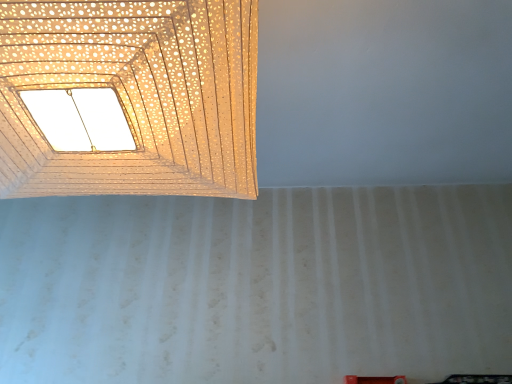
This screenshot has height=384, width=512. What do you see at coordinates (135, 95) in the screenshot?
I see `matte woven lampshade at upper left` at bounding box center [135, 95].

Find the location of a particular element. matte woven lampshade at upper left is located at coordinates (135, 95).

Locate an element on the screen. Image resolution: width=512 pixels, height=384 pixels. matte woven lampshade at upper left is located at coordinates (135, 95).